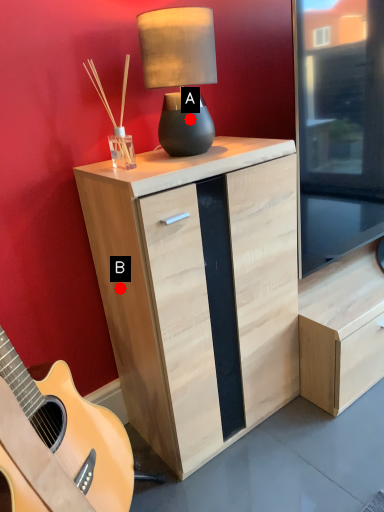
Question: Two points are circled on the image, labeled by A and B beside each circle. Which point appears farthest from the camera in this image?

Choices:
 (A) A is further
 (B) B is further

Answer: (B)